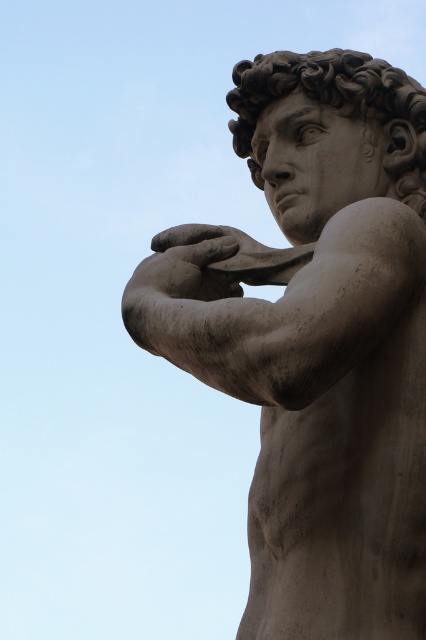
Which is above, smooth stone head at center or matte stone hand at center?

smooth stone head at center

Who is more distant from viewer, (252, 161) or (180, 292)?

The point (252, 161) is behind.

Locate an element on the screen. smooth stone head at center is located at coordinates (333, 100).

The width and height of the screenshot is (426, 640). Describe the element at coordinates (322, 344) in the screenshot. I see `stone statue at center` at that location.

Can you confirm if stone statue at center is positioned to the left of matte stone hand at center?

No, stone statue at center is not to the left of matte stone hand at center.

Measure the distance between point (377,268) and camera.

Point (377,268) is 169.14 feet away from camera.

Image resolution: width=426 pixels, height=640 pixels. In order to click on stone statue at center in this screenshot , I will do `click(322, 344)`.

Can you confirm if stone statue at center is positioned above smooth stone head at center?

No, stone statue at center is not above smooth stone head at center.

Does point (261, 497) come farther from viewer compared to point (230, 90)?

No, it is in front of (230, 90).

Which is in front, point (322, 624) or point (316, 58)?

Point (322, 624) is in front.

Where is `stone statue at center`? Image resolution: width=426 pixels, height=640 pixels. stone statue at center is located at coordinates (322, 344).